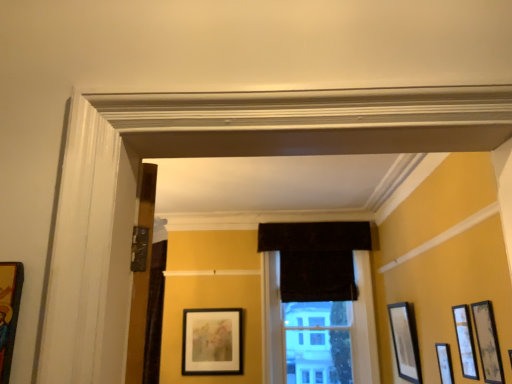
At what (x,y) coordinates should I click in order to perform the action: click on wooden framed picture at right, which is the fourth picture frame from right to left. Please return your answer as a coordinate pair (x, y). Looking at the image, I should click on (488, 342).

You are a GUI agent. You are given a task and a screenshot of the screen. Output one action in this format:
    pyautogui.click(x=<x>, y=<y>)
    Task: Click on the matte black picture frame at right, the 6th picture frame from the left
    The width and height of the screenshot is (512, 384).
    Given the screenshot: What is the action you would take?
    pyautogui.click(x=405, y=341)

At what (x,y) coordinates should I click in order to perform the action: click on matte black picture frame at right, the third picture frame in the front-to-back sequence. Please return your answer as a coordinate pair (x, y). Looking at the image, I should click on (465, 341).

The image size is (512, 384). What are the coordinates of `matte black picture frame at right, the fourth picture frame viewed from the front` in the screenshot? It's located at (444, 363).

What do you see at coordinates (315, 280) in the screenshot? I see `velvet dark brown curtain at center` at bounding box center [315, 280].

Identify the location of wooden framed picture at right, which is counted as the 5th picture frame, starting from the back. (488, 342).

From a real-world perspective, is velvet dark brown curtain at center above or below matte black picture frame at right, positioned as the fifth picture frame in left-to-right order?

velvet dark brown curtain at center is above matte black picture frame at right, positioned as the fifth picture frame in left-to-right order.

Considering the relative positions of velvet dark brown curtain at center and matte black picture frame at right, the fourth picture frame viewed from the front, in the image provided, is velvet dark brown curtain at center to the left of matte black picture frame at right, the fourth picture frame viewed from the front, from the viewer's perspective?

Yes.

Is velvet dark brown curtain at center taller or shorter than matte black picture frame at right, the 2th picture frame when ordered from right to left?

velvet dark brown curtain at center is taller than matte black picture frame at right, the 2th picture frame when ordered from right to left.

The width and height of the screenshot is (512, 384). What are the coordinates of `the 2nd picture frame in front of the velvet dark brown curtain at center, starting your count from the anchor` in the screenshot? It's located at (444, 363).

How far apart are wooden framed picture at right, the second picture frame from the front, and matte black picture frame at right, positioned as the fifth picture frame in left-to-right order?

wooden framed picture at right, the second picture frame from the front, is 71.49 centimeters away from matte black picture frame at right, positioned as the fifth picture frame in left-to-right order.

Is wooden framed picture at right, the second picture frame from the front, bigger than matte black picture frame at right, positioned as the fifth picture frame in left-to-right order?

Yes.

Is wooden framed picture at right, which is counted as the 5th picture frame, starting from the back, aimed at matte black picture frame at right, the third picture frame from the back?

No, wooden framed picture at right, which is counted as the 5th picture frame, starting from the back, is not facing towards matte black picture frame at right, the third picture frame from the back.

Would you say matte black picture frame at right, positioned as the fifth picture frame in left-to-right order, is part of wooden framed picture at right, the second picture frame from the front,'s contents?

That's incorrect, matte black picture frame at right, positioned as the fifth picture frame in left-to-right order, is not inside wooden framed picture at right, the second picture frame from the front.

Is black velvet curtain at center turned away from velvet dark brown curtain at center?

Yes.

From a real-world perspective, which object rests below the other?

In real-world perspective, velvet dark brown curtain at center is lower.

Considering the positions of points (355, 291) and (349, 240), is point (355, 291) farther from camera compared to point (349, 240)?

That is True.

Between black velvet curtain at center and velvet dark brown curtain at center, which one has smaller width?

black velvet curtain at center is thinner.

Who is taller, matte black picture frame at right, the 2th picture frame when ordered from right to left, or matte black picture frame at right, the third picture frame in the front-to-back sequence?

With more height is matte black picture frame at right, the third picture frame in the front-to-back sequence.

Is matte black picture frame at right, the fourth picture frame viewed from the front, behind matte black picture frame at right, which is the 4th picture frame in back-to-front order?

Yes, it is.

You are a GUI agent. You are given a task and a screenshot of the screen. Output one action in this format:
    pyautogui.click(x=<x>, y=<y>)
    Task: Click on the picture frame that is the 3rd object directly below the matte black picture frame at right, the third picture frame in the front-to-back sequence (from a real-world perspective)
    The width and height of the screenshot is (512, 384).
    Given the screenshot: What is the action you would take?
    pyautogui.click(x=444, y=363)

Is matte black picture frame at right, the third picture frame from the back, wider or thinner than matte black picture frame at right, which is the 4th picture frame in back-to-front order?

Considering their sizes, matte black picture frame at right, the third picture frame from the back, looks broader than matte black picture frame at right, which is the 4th picture frame in back-to-front order.

Does wooden picture frame at left, placed as the 6th picture frame when sorted from back to front, have a greater width compared to matte black picture frame at center, the sixth picture frame viewed from the front?

In fact, wooden picture frame at left, placed as the 6th picture frame when sorted from back to front, might be narrower than matte black picture frame at center, the sixth picture frame viewed from the front.

Is wooden picture frame at left, the 6th picture frame viewed from the right, looking in the opposite direction of matte black picture frame at center, which is the fifth picture frame from right to left?

Yes, wooden picture frame at left, the 6th picture frame viewed from the right, is facing away from matte black picture frame at center, which is the fifth picture frame from right to left.

Is wooden picture frame at left, the 6th picture frame viewed from the right, placed right next to matte black picture frame at center, which is the fifth picture frame from right to left?

No, wooden picture frame at left, the 6th picture frame viewed from the right, is not touching matte black picture frame at center, which is the fifth picture frame from right to left.

Considering the positions of objects wooden picture frame at left, the 6th picture frame viewed from the right, and matte black picture frame at center, which ranks as the second picture frame in left-to-right order, in the image provided, who is more to the right, wooden picture frame at left, the 6th picture frame viewed from the right, or matte black picture frame at center, which ranks as the second picture frame in left-to-right order,?

matte black picture frame at center, which ranks as the second picture frame in left-to-right order.

Is velvet dark brown curtain at center directly adjacent to wooden picture frame at left, marked as the first picture frame in a left-to-right arrangement?

No.

Considering the relative sizes of velvet dark brown curtain at center and wooden picture frame at left, marked as the first picture frame in a left-to-right arrangement, in the image provided, is velvet dark brown curtain at center shorter than wooden picture frame at left, marked as the first picture frame in a left-to-right arrangement,?

Incorrect, the height of velvet dark brown curtain at center does not fall short of that of wooden picture frame at left, marked as the first picture frame in a left-to-right arrangement.

Identify the location of window to the right of wooden picture frame at left, marked as the first picture frame in a left-to-right arrangement. The width and height of the screenshot is (512, 384). (315, 280).

Does matte black picture frame at center, which ranks as the second picture frame in left-to-right order, touch velvet dark brown curtain at center?

No, matte black picture frame at center, which ranks as the second picture frame in left-to-right order, is not in contact with velvet dark brown curtain at center.

Between matte black picture frame at center, which is the fifth picture frame from right to left, and velvet dark brown curtain at center, which one has less height?

matte black picture frame at center, which is the fifth picture frame from right to left.

The height and width of the screenshot is (384, 512). I want to click on window lying above the matte black picture frame at center, arranged as the first picture frame when viewed from the back (from the image's perspective), so click(315, 280).

I want to click on window above the matte black picture frame at right, the third picture frame from the back (from a real-world perspective), so click(x=315, y=280).

Identify the location of the 2nd picture frame to the left of the matte black picture frame at right, the fourth picture frame viewed from the front, starting your count from the anchor. This screenshot has width=512, height=384. (488, 342).

Based on their spatial positions, is matte black picture frame at right, placed as the fourth picture frame when sorted from left to right, or wooden picture frame at left, which appears as the 1th picture frame when viewed from the front, further from wooden framed picture at right, which appears as the 3th picture frame when viewed from the left?

wooden picture frame at left, which appears as the 1th picture frame when viewed from the front.

Which object lies nearer to the anchor point matte black picture frame at right, the 6th picture frame from the left, wooden framed picture at right, the second picture frame from the front, or black velvet curtain at center?

Among the two, black velvet curtain at center is located nearer to matte black picture frame at right, the 6th picture frame from the left.

Estimate the real-world distances between objects in this image. Which object is further from matte black picture frame at right, the fourth picture frame viewed from the front, matte black picture frame at right, the 1th picture frame in the right-to-left sequence, or matte black picture frame at center, which ranks as the second picture frame in left-to-right order?

matte black picture frame at center, which ranks as the second picture frame in left-to-right order, is positioned further to the anchor matte black picture frame at right, the fourth picture frame viewed from the front.

When comparing their distances from wooden picture frame at left, placed as the 6th picture frame when sorted from back to front, does matte black picture frame at center, the sixth picture frame viewed from the front, or black velvet curtain at center seem further?

Based on the image, black velvet curtain at center appears to be further to wooden picture frame at left, placed as the 6th picture frame when sorted from back to front.

Consider the image. Looking at the image, which one is located closer to wooden picture frame at left, marked as the first picture frame in a left-to-right arrangement, black velvet curtain at center or velvet dark brown curtain at center?

The object closer to wooden picture frame at left, marked as the first picture frame in a left-to-right arrangement, is velvet dark brown curtain at center.

Considering their positions, is matte black picture frame at right, the fourth picture frame viewed from the front, positioned further to wooden framed picture at right, which appears as the 3th picture frame when viewed from the left, than matte black picture frame at center, the sixth picture frame viewed from the front?

matte black picture frame at center, the sixth picture frame viewed from the front, is positioned further to the anchor wooden framed picture at right, which appears as the 3th picture frame when viewed from the left.

Looking at the image, which one is located closer to matte black picture frame at center, which is the fifth picture frame from right to left, matte black picture frame at right, arranged as the 3th picture frame when viewed from the right, or velvet dark brown curtain at center?

The object closer to matte black picture frame at center, which is the fifth picture frame from right to left, is velvet dark brown curtain at center.

From the image, which object appears to be farther from matte black picture frame at right, which is the 4th picture frame in back-to-front order, velvet dark brown curtain at center or matte black picture frame at right, acting as the 5th picture frame starting from the front?

velvet dark brown curtain at center lies further to matte black picture frame at right, which is the 4th picture frame in back-to-front order, than the other object.

The height and width of the screenshot is (384, 512). Find the location of `window located between wooden framed picture at right, which is the fourth picture frame from right to left, and black velvet curtain at center in the depth direction`. window located between wooden framed picture at right, which is the fourth picture frame from right to left, and black velvet curtain at center in the depth direction is located at coordinates (315, 280).

Find the location of `window between matte black picture frame at right, arranged as the 3th picture frame when viewed from the right, and black velvet curtain at center in the front-back direction`. window between matte black picture frame at right, arranged as the 3th picture frame when viewed from the right, and black velvet curtain at center in the front-back direction is located at coordinates (315, 280).

Where is `window between matte black picture frame at right, the fourth picture frame viewed from the front, and matte black picture frame at center, which ranks as the second picture frame in left-to-right order, in the front-back direction`? This screenshot has height=384, width=512. window between matte black picture frame at right, the fourth picture frame viewed from the front, and matte black picture frame at center, which ranks as the second picture frame in left-to-right order, in the front-back direction is located at coordinates (315, 280).

Where is `picture frame between matte black picture frame at right, placed as the fourth picture frame when sorted from left to right, and matte black picture frame at right, acting as the 5th picture frame starting from the front, from front to back`? The width and height of the screenshot is (512, 384). picture frame between matte black picture frame at right, placed as the fourth picture frame when sorted from left to right, and matte black picture frame at right, acting as the 5th picture frame starting from the front, from front to back is located at coordinates (444, 363).